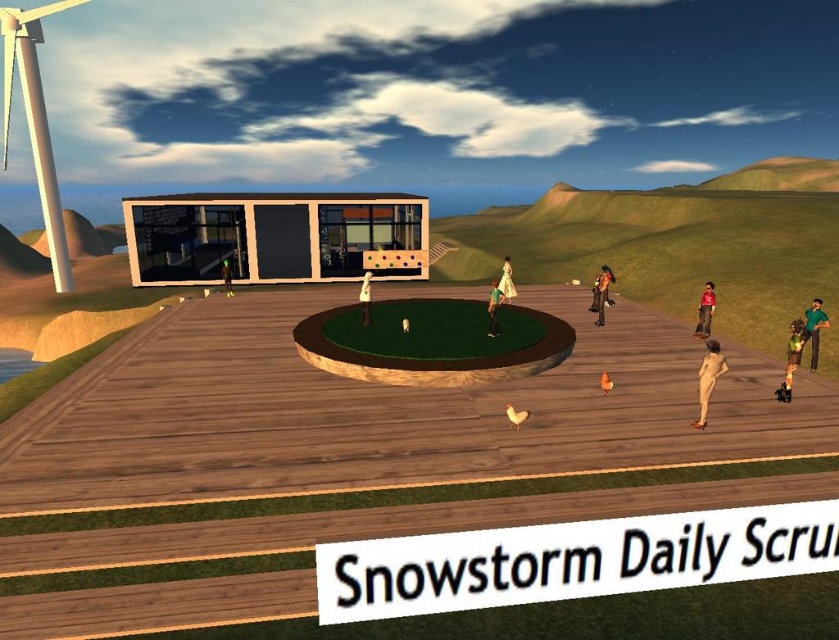
Is green fabric dress at right positioned before white satin dress at center?

Yes, it is.

Who is lower down, green fabric dress at right or white satin dress at center?

green fabric dress at right is lower down.

Is point (822, 312) more distant than point (501, 276)?

No, (822, 312) is closer to viewer.

You are a GUI agent. You are given a task and a screenshot of the screen. Output one action in this format:
    pyautogui.click(x=<x>, y=<y>)
    Task: Click on the green fabric dress at right
    This screenshot has width=839, height=640.
    Given the screenshot: What is the action you would take?
    pyautogui.click(x=813, y=330)

Is green fabric dress at lower right above green metallic helmet at center?

No.

Is point (796, 356) positioned before point (223, 278)?

Yes, it is.

Identify the location of green fabric dress at lower right. The image size is (839, 640). (791, 358).

Can you confirm if green grass at center is positioned above white matte statue at center?

Yes, green grass at center is above white matte statue at center.

Does green grass at center have a lesser height compared to white matte statue at center?

In fact, green grass at center may be taller than white matte statue at center.

Is point (61, 548) positioned in front of point (361, 312)?

Yes, it is in front of point (361, 312).

Where is `green grass at center`? This screenshot has width=839, height=640. green grass at center is located at coordinates (520, 400).